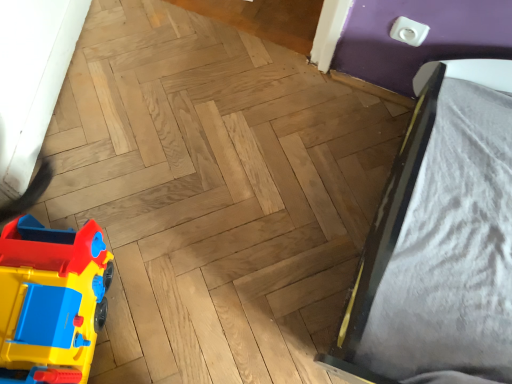
Locate an element on the screen. The width and height of the screenshot is (512, 384). free space to the back side of matte plastic toy car at lower left is located at coordinates (121, 209).